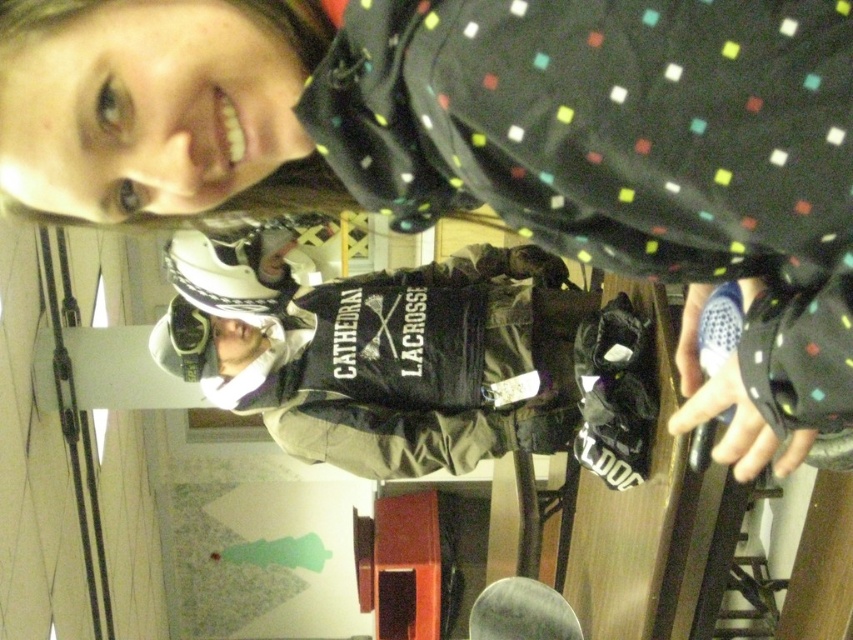
You are a sports equipment organizer in a storage room. You need to place the camouflage fabric snowboard at center and the matte black goggles at center on a shelf that is 1 meter wide. Can both items fit side by side without overlapping?

The camouflage fabric snowboard at center might be wider than matte black goggles at center, so it is uncertain if both items can fit side by side on a 1 meter wide shelf without overlapping. Measure their combined width to confirm.

You are a sports equipment organizer who needs to stack the camouflage fabric snowboard at center and the matte black goggles at center vertically in a narrow storage rack. Given that the rack can only accommodate items up to the height of the taller object, will both items fit without exceeding the rack height?

The camouflage fabric snowboard at center is taller than the matte black goggles at center. Since the rack can hold up to the height of the taller item, both items will fit as the snowboard reaches the maximum allowed height and the goggles are shorter.

Looking at this image, you are standing in a room with a lacrosse player wearing a black polka dot jacket and a helmet. You notice two points marked in the scene. Which of the two points, point 1 at coordinates (335, 454) or point 2 at coordinates (187, 355), is closer to you?

Point 1 at coordinates (335, 454) is closer to you because it is further to the viewer than point 2 at coordinates (187, 355).